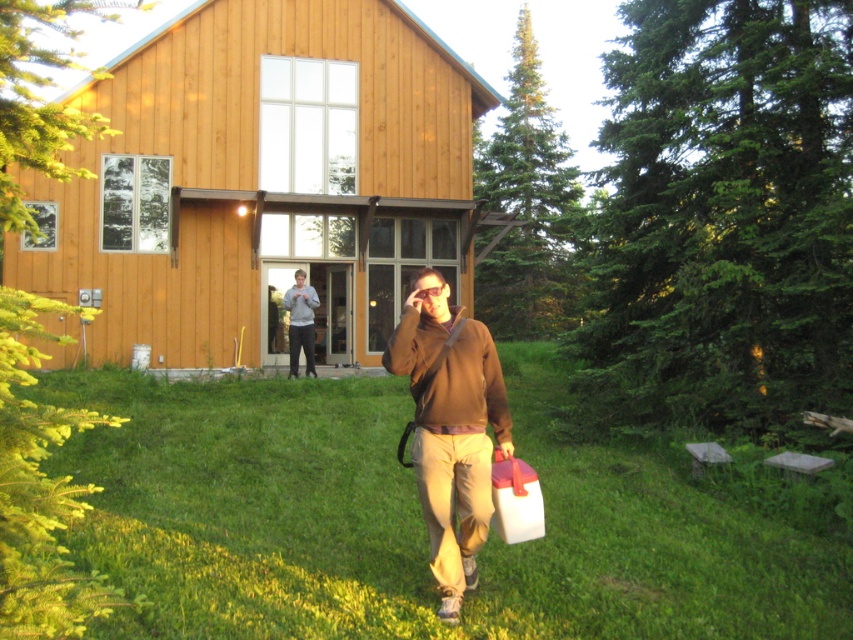
You are planning to set up a picnic area in the scene. Based on the sizes of the green grass at center and the wooden cabin at center, which area would be more suitable for placing a large picnic blanket?

The wooden cabin at center is larger than the green grass at center, so the area around the wooden cabin at center would be more suitable for placing a large picnic blanket.

You are standing in the outdoor scene and want to reach the wooden cabin at center. There is a gray cotton sweatshirt at center in your path. Which object is closer to you, and will you need to move the sweatshirt to get to the cabin?

The gray cotton sweatshirt at center is closer to you than the wooden cabin at center. Since the sweatshirt is in your path and closer, you will need to move it to reach the cabin.

You are standing in the outdoor scene and want to place a small potted plant exactly at the center of the image. Is the brown fleece jacket at center currently blocking that spot?

The brown fleece jacket at center is located at point (450,428), which is close to the center but not exactly at the center coordinates. Therefore, it might not be blocking the exact center spot, but it is nearby.